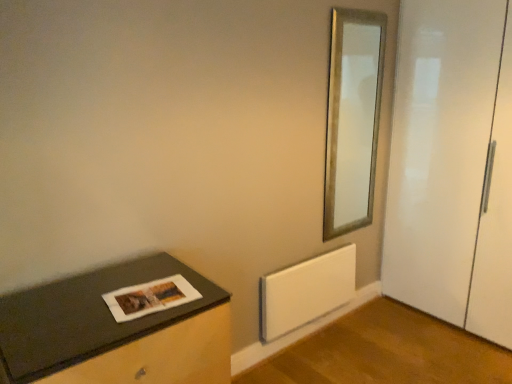
Question: Is the depth of matte paper magazine at lower left greater than that of gold metallic mirror at upper right?

Choices:
 (A) yes
 (B) no

Answer: (B)

Question: Is matte paper magazine at lower left wider than gold metallic mirror at upper right?

Choices:
 (A) no
 (B) yes

Answer: (B)

Question: From a real-world perspective, is matte paper magazine at lower left located higher than gold metallic mirror at upper right?

Choices:
 (A) yes
 (B) no

Answer: (B)

Question: From the image's perspective, is matte paper magazine at lower left below gold metallic mirror at upper right?

Choices:
 (A) yes
 (B) no

Answer: (A)

Question: From a real-world perspective, is matte paper magazine at lower left under gold metallic mirror at upper right?

Choices:
 (A) yes
 (B) no

Answer: (A)

Question: Is matte paper magazine at lower left taller than gold metallic mirror at upper right?

Choices:
 (A) yes
 (B) no

Answer: (B)

Question: Does dark gray matte table at lower left appear on the left side of matte paper magazine at lower left?

Choices:
 (A) yes
 (B) no

Answer: (A)

Question: Can you confirm if dark gray matte table at lower left is thinner than matte paper magazine at lower left?

Choices:
 (A) no
 (B) yes

Answer: (A)

Question: From a real-world perspective, is dark gray matte table at lower left on matte paper magazine at lower left?

Choices:
 (A) yes
 (B) no

Answer: (B)

Question: Is dark gray matte table at lower left aimed at matte paper magazine at lower left?

Choices:
 (A) no
 (B) yes

Answer: (A)

Question: Considering the relative sizes of dark gray matte table at lower left and matte paper magazine at lower left in the image provided, is dark gray matte table at lower left shorter than matte paper magazine at lower left?

Choices:
 (A) yes
 (B) no

Answer: (B)

Question: Are dark gray matte table at lower left and matte paper magazine at lower left located far from each other?

Choices:
 (A) yes
 (B) no

Answer: (B)

Question: Could dark gray matte table at lower left be considered to be inside white matte radiator at lower center?

Choices:
 (A) no
 (B) yes

Answer: (A)